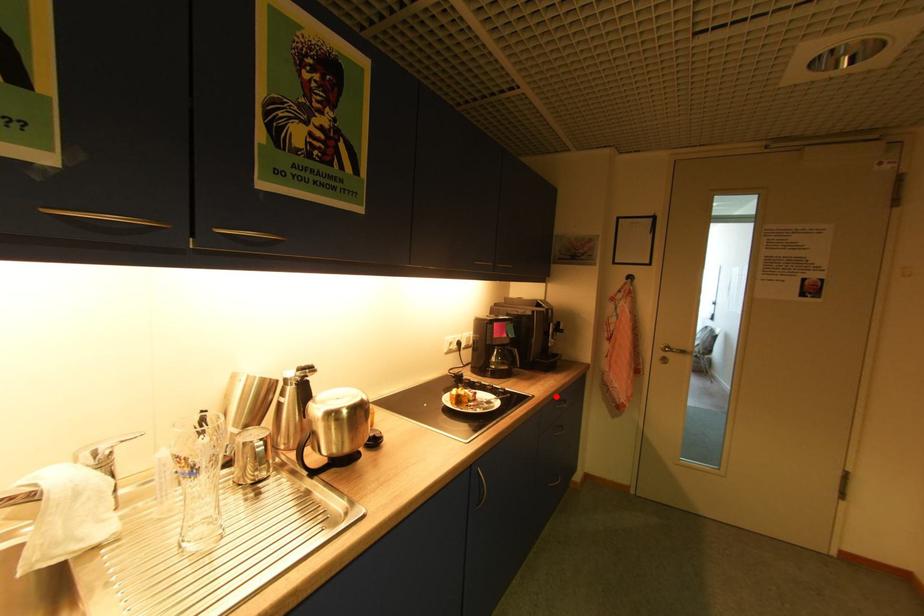
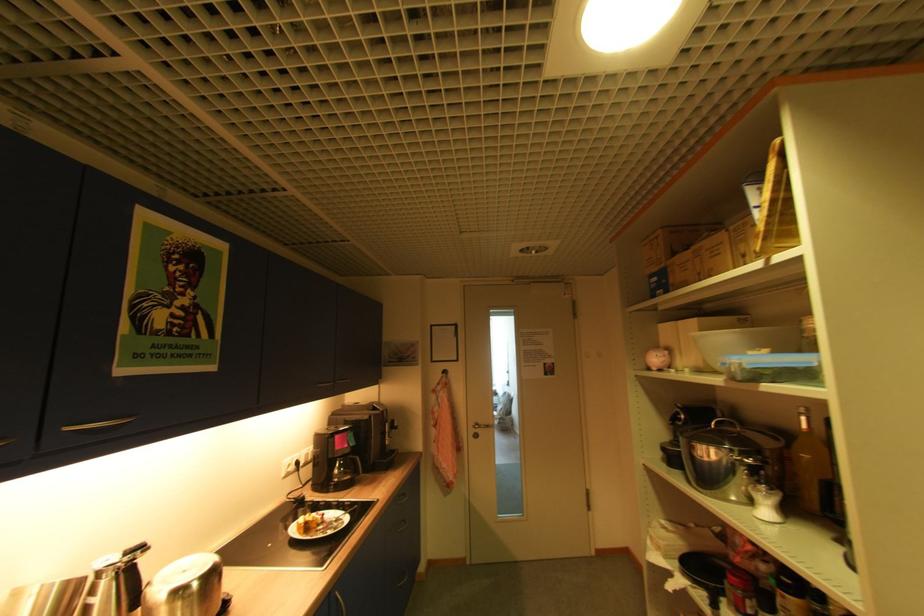
Where in the second image is the point corresponding to the highlighted location from the first image?

(398, 495)